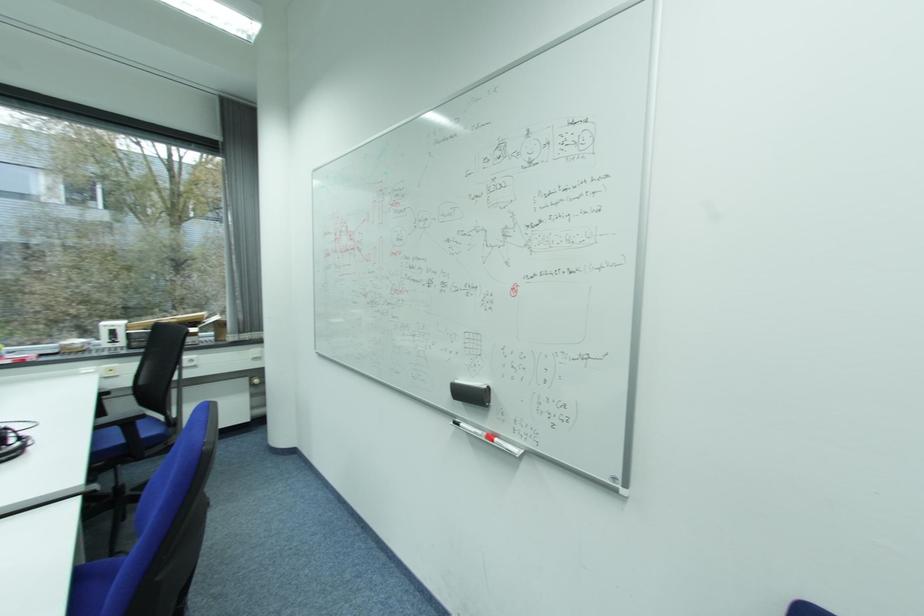
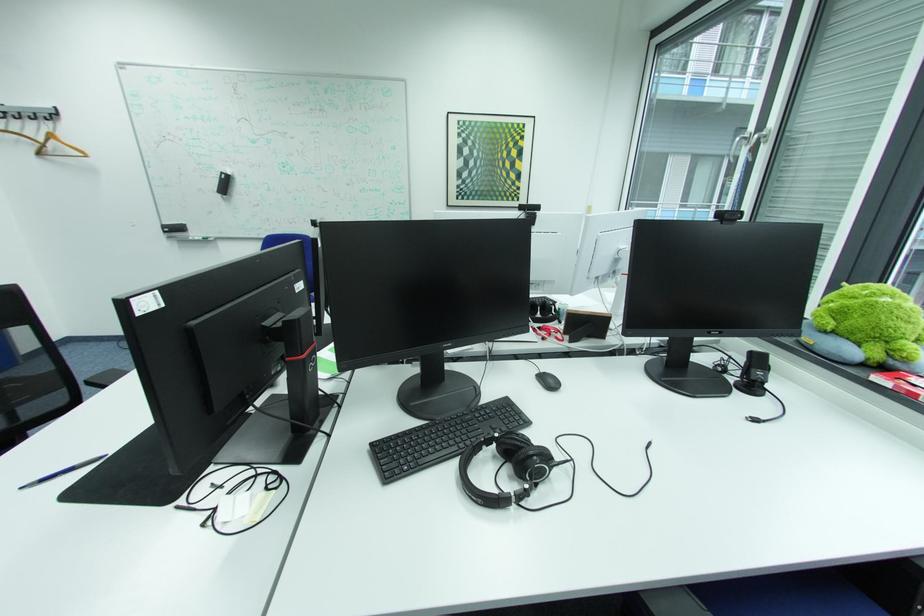
Question: I am providing you with two images of the same scene from different viewpoints. Please identify which objects are invisible in image2.

Choices:
 (A) black microphone
 (B) whiteboard marker
 (C) black computer mouse
 (D) none of these

Answer: (D)